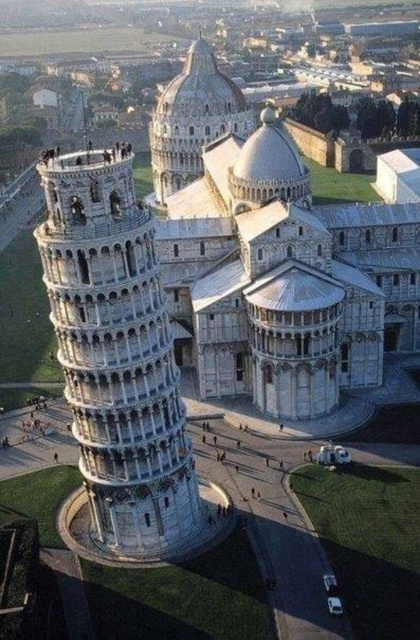
Question: Is white stone tower at left wider than white stone dome at upper center?

Choices:
 (A) no
 (B) yes

Answer: (A)

Question: Does white stone tower at left have a larger size compared to white stone dome at upper center?

Choices:
 (A) no
 (B) yes

Answer: (A)

Question: Does white stone tower at left appear on the right side of white stone dome at upper center?

Choices:
 (A) no
 (B) yes

Answer: (A)